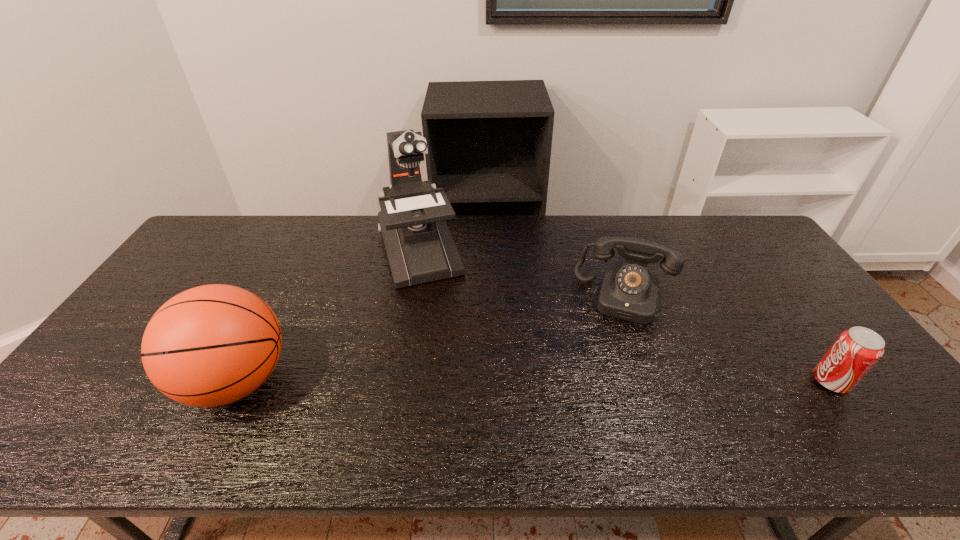
The width and height of the screenshot is (960, 540). I want to click on object positioned at the near right corner, so click(x=856, y=350).

In the image, there is a desktop. Where is `vacant space at the far edge`? The width and height of the screenshot is (960, 540). vacant space at the far edge is located at coordinates (590, 218).

You are a GUI agent. You are given a task and a screenshot of the screen. Output one action in this format:
    pyautogui.click(x=<x>, y=<y>)
    Task: Click on the vacant space at the near edge of the desktop
    This screenshot has height=540, width=960.
    Given the screenshot: What is the action you would take?
    pyautogui.click(x=682, y=406)

Identify the location of vacant region at the left edge of the desktop. The width and height of the screenshot is (960, 540). (212, 257).

Find the location of a particular element. vacant region at the right edge of the desktop is located at coordinates (803, 305).

Identify the location of vacant space at the far left corner of the desktop. The image size is (960, 540). point(230,232).

I want to click on vacant region at the near left corner, so click(x=98, y=397).

Locate an element on the screen. The height and width of the screenshot is (540, 960). vacant space at the far right corner of the desktop is located at coordinates (721, 220).

This screenshot has height=540, width=960. I want to click on free spot between the soda can and the third object from left to right, so click(729, 339).

Find the location of a particular element. This screenshot has width=960, height=540. vacant space that's between the second object from right to left and the tallest object is located at coordinates (522, 273).